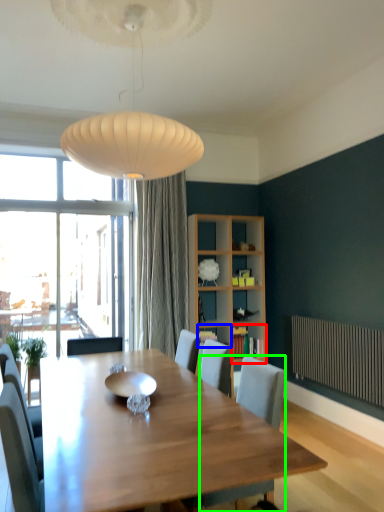
Question: Considering the real-world distances, which object is closest to shelf (highlighted by a red box)? shelf (highlighted by a blue box) or chair (highlighted by a green box).

Choices:
 (A) shelf
 (B) chair

Answer: (A)